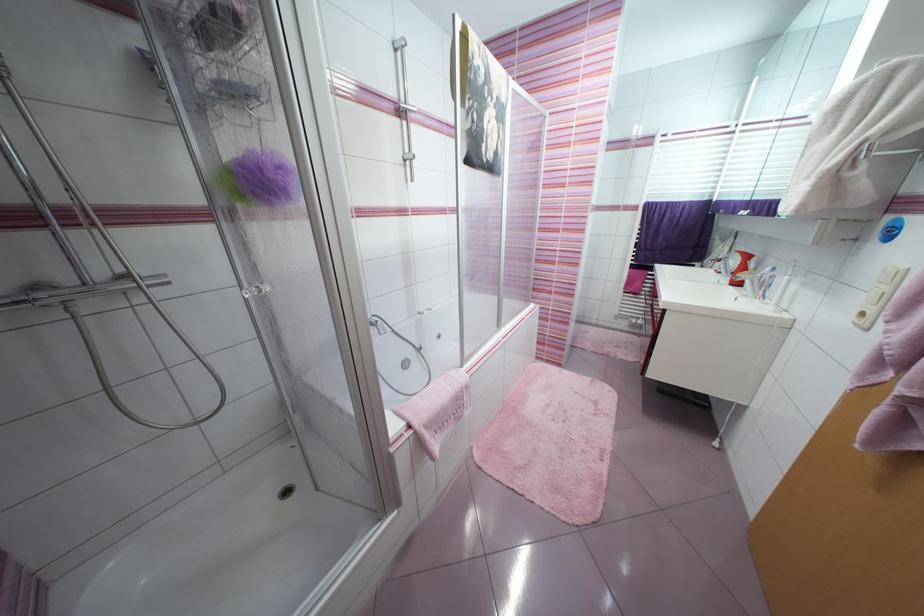
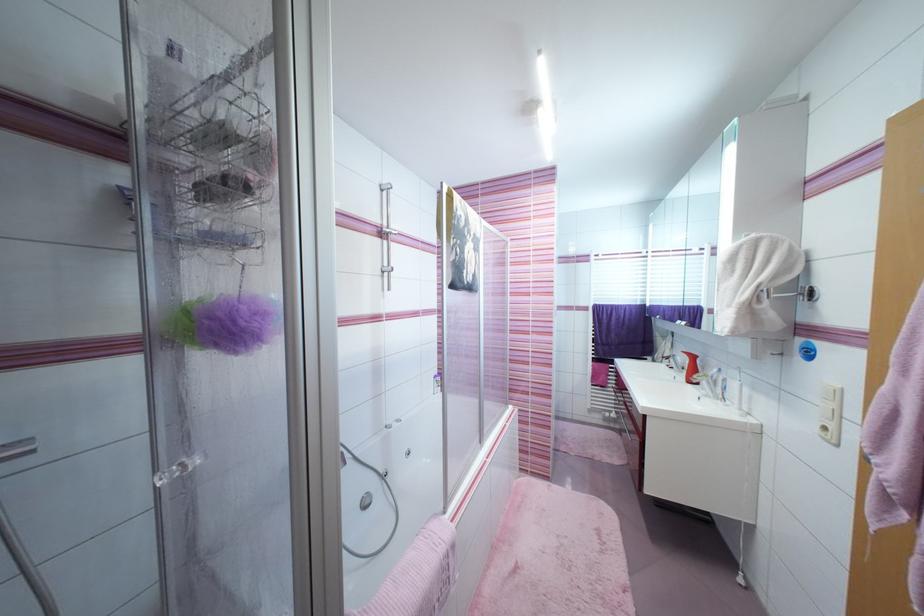
The point at (x=400, y=52) is marked in the first image. Where is the corresponding point in the second image?

(387, 192)